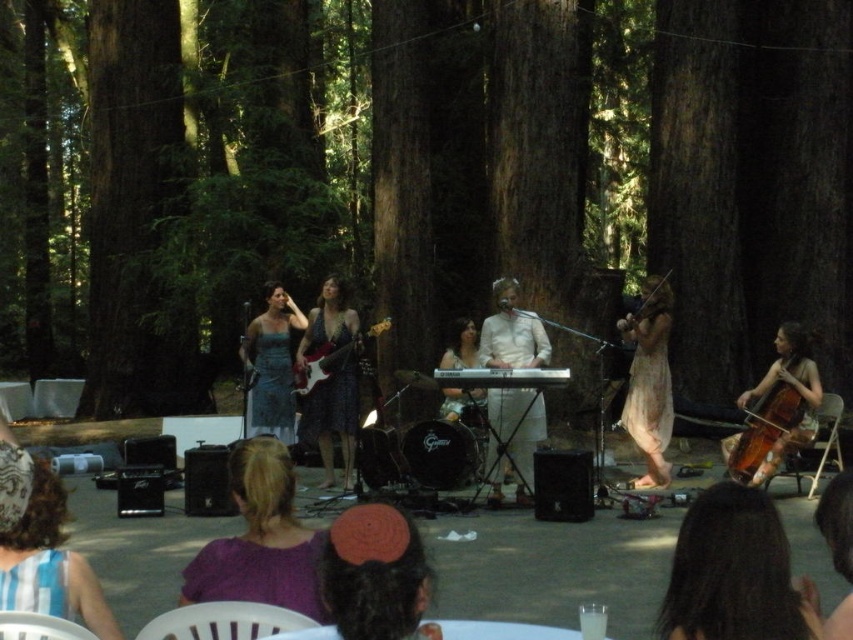
Does dark brown hair at lower right have a greater width compared to matte white keyboard at center?

In fact, dark brown hair at lower right might be narrower than matte white keyboard at center.

Does dark brown hair at lower right appear on the right side of matte white keyboard at center?

Indeed, dark brown hair at lower right is positioned on the right side of matte white keyboard at center.

Between point (776, 531) and point (440, 365), which one is positioned behind?

The point (440, 365) is behind.

You are a GUI agent. You are given a task and a screenshot of the screen. Output one action in this format:
    pyautogui.click(x=<x>, y=<y>)
    Task: Click on the dark brown hair at lower right
    The width and height of the screenshot is (853, 640).
    Given the screenshot: What is the action you would take?
    pyautogui.click(x=734, y=572)

Based on the photo, can you confirm if dark brown wood tree at left is taller than white matte keyboard at center?

No, dark brown wood tree at left is not taller than white matte keyboard at center.

Is point (164, 369) positioned in front of point (523, 461)?

No, it is behind (523, 461).

Which is behind, point (86, 227) or point (532, 474)?

The point (86, 227) is more distant.

Find the location of a particular element. This screenshot has width=853, height=640. dark brown wood tree at left is located at coordinates (137, 216).

Does point (105, 112) come behind point (376, 588)?

Yes.

In the scene shown: Who is shorter, dark brown wood tree at left or brown fabric headband at center?

Standing shorter between the two is brown fabric headband at center.

Which is in front, point (161, 326) or point (363, 580)?

Positioned in front is point (363, 580).

Identify the location of dark brown wood tree at left. 137,216.